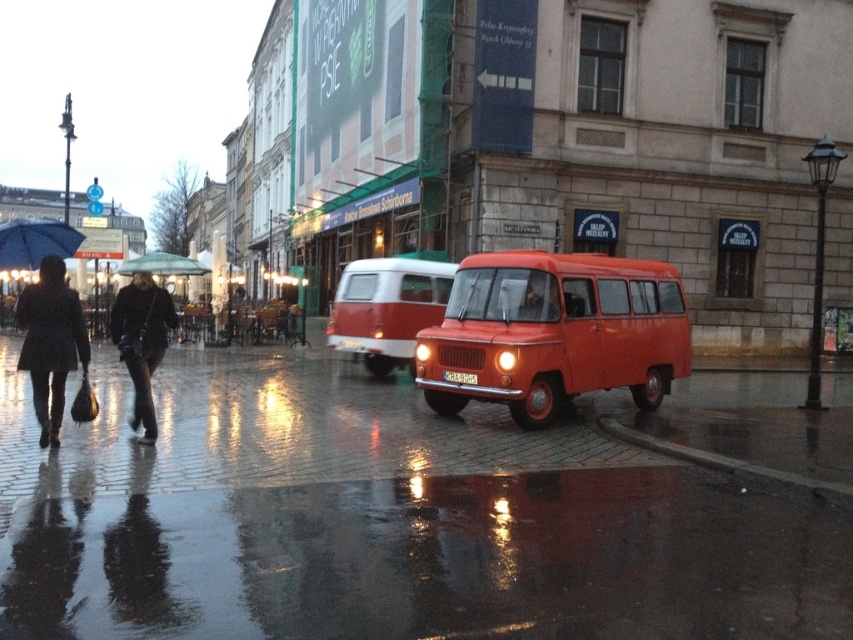
Question: Which point is farther to the camera?

Choices:
 (A) matte red van at center
 (B) glossy brick pavement at center
 (C) blue matte umbrella at left

Answer: (A)

Question: Is dark gray fabric coat at lower left thinner than transparent fabric umbrella at center?

Choices:
 (A) yes
 (B) no

Answer: (A)

Question: Among these points, which one is nearest to the camera?

Choices:
 (A) coord(49,248)
 (B) coord(25,300)
 (C) coord(112,396)
 (D) coord(415,371)

Answer: (B)

Question: Which point is farther to the camera?

Choices:
 (A) matte orange van at center
 (B) transparent fabric umbrella at center
 (C) blue matte umbrella at left

Answer: (B)

Question: Can you confirm if matte red van at center is positioned below matte black coat at left?

Choices:
 (A) yes
 (B) no

Answer: (B)

Question: Is matte orange van at center positioned at the back of matte black coat at left?

Choices:
 (A) no
 (B) yes

Answer: (B)